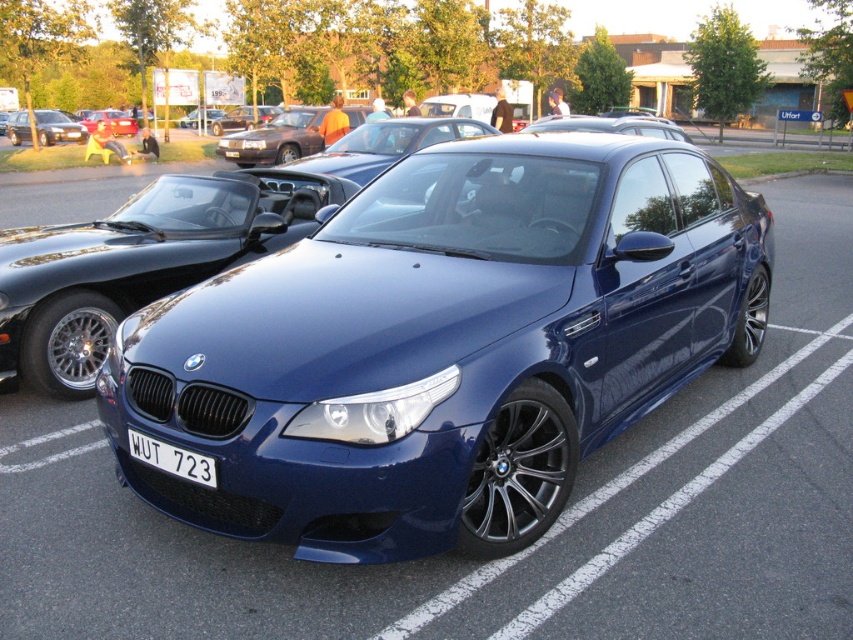
Question: Does satin blue car at center have a greater width compared to matte black car at center?

Choices:
 (A) no
 (B) yes

Answer: (A)

Question: Is satin blue car at center to the right of white plastic license plate at center from the viewer's perspective?

Choices:
 (A) no
 (B) yes

Answer: (B)

Question: Among these objects, which one is farthest from the camera?

Choices:
 (A) matte black car at center
 (B) matte black sedan at left
 (C) satin blue car at center
 (D) white plastic license plate at center

Answer: (B)

Question: Considering the real-world distances, which object is closest to the matte black car at center?

Choices:
 (A) satin blue car at center
 (B) white plastic license plate at center
 (C) matte black sedan at left

Answer: (C)

Question: Can you confirm if matte black sedan at left is positioned to the right of matte black car at center?

Choices:
 (A) no
 (B) yes

Answer: (A)

Question: Which object is closer to the camera taking this photo?

Choices:
 (A) satin blue car at center
 (B) matte black car at center

Answer: (A)